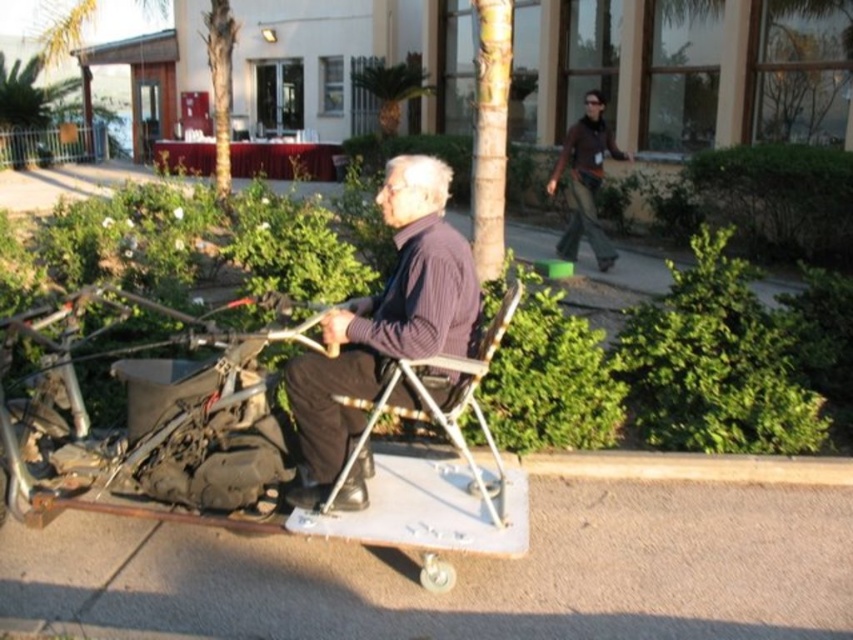
Question: Is gray concrete pavement at lower center thinner than metallic silver folding chair at center?

Choices:
 (A) yes
 (B) no

Answer: (B)

Question: Which point is farther to the camera?

Choices:
 (A) gray concrete pavement at lower center
 (B) smooth light brown tree trunk at center

Answer: (B)

Question: Does dark ribbed sweater at center appear over metallic silver folding chair at center?

Choices:
 (A) yes
 (B) no

Answer: (A)

Question: Which of the following is the farthest from the observer?

Choices:
 (A) (500, 132)
 (B) (602, 136)
 (C) (358, 400)

Answer: (B)

Question: Which of these objects is positioned farthest from the dark ribbed sweater at center?

Choices:
 (A) brown textured pants at upper right
 (B) green leafy tree at upper center

Answer: (B)

Question: Does gray concrete pavement at lower center come in front of smooth light brown tree trunk at center?

Choices:
 (A) no
 (B) yes

Answer: (B)